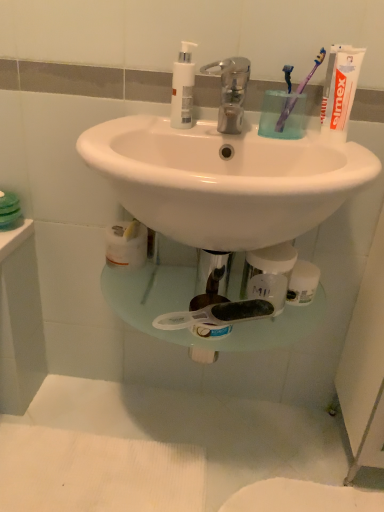
Locate an element on the screen. This screenshot has height=512, width=384. free space that is in between white plastic pump bottle at upper center and white matte toothpaste at upper right is located at coordinates (235, 131).